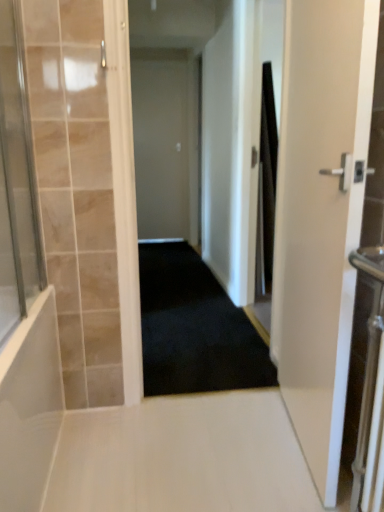
What do you see at coordinates (194, 328) in the screenshot? I see `black carpet at center` at bounding box center [194, 328].

This screenshot has width=384, height=512. Find the location of `black fabric shower curtain at right`. black fabric shower curtain at right is located at coordinates (268, 165).

Is transparent glass shower door at left touching white glossy door at right, the 1th door positioned from the front?

No.

Is transparent glass shower door at left completely or partially outside of white glossy door at right, the 2th door positioned from the left?

Yes, transparent glass shower door at left is not within white glossy door at right, the 2th door positioned from the left.

Is transparent glass shower door at left facing away from white glossy door at right, the 2th door positioned from the left?

transparent glass shower door at left does not have its back to white glossy door at right, the 2th door positioned from the left.

Which is behind, point (142, 503) or point (159, 67)?

The point (159, 67) is more distant.

Can you tell me how much white glossy floor at center and white matte door at center, which ranks as the 1th door in back-to-front order, differ in facing direction?

The angular difference between white glossy floor at center and white matte door at center, which ranks as the 1th door in back-to-front order, is 180 degrees.

Where is `door located behind the white glossy floor at center`? The image size is (384, 512). door located behind the white glossy floor at center is located at coordinates (161, 144).

From a real-world perspective, between transparent glass shower door at left and black fabric shower curtain at right, who is vertically lower?

From a 3D spatial view, black fabric shower curtain at right is below.

Consider the image. Does transparent glass shower door at left turn towards black fabric shower curtain at right?

No, transparent glass shower door at left is not turned towards black fabric shower curtain at right.

Locate an element on the screen. The image size is (384, 512). glass door above the black fabric shower curtain at right (from a real-world perspective) is located at coordinates (17, 180).

In terms of size, does transparent glass shower door at left appear bigger or smaller than black fabric shower curtain at right?

Considering their sizes, transparent glass shower door at left takes up more space than black fabric shower curtain at right.

Is white matte door at center, placed as the 1th door when sorted from left to right, next to transparent glass shower door at left?

No.

Does white matte door at center, which ranks as the 2th door in right-to-left order, contain transparent glass shower door at left?

No, transparent glass shower door at left is located outside of white matte door at center, which ranks as the 2th door in right-to-left order.

Based on the photo, from a real-world perspective, is white matte door at center, which appears as the 2th door when viewed from the front, physically above transparent glass shower door at left?

No, from a real-world perspective, white matte door at center, which appears as the 2th door when viewed from the front, is not above transparent glass shower door at left.

Is white matte door at center, which ranks as the 1th door in back-to-front order, in front of or behind transparent glass shower door at left in the image?

white matte door at center, which ranks as the 1th door in back-to-front order, is positioned farther from the viewer than transparent glass shower door at left.

Is white matte door at center, which appears as the 2th door when viewed from the front, oriented towards white glossy door at right, placed as the first door when sorted from right to left?

Yes, white matte door at center, which appears as the 2th door when viewed from the front, is aimed at white glossy door at right, placed as the first door when sorted from right to left.

Is white matte door at center, placed as the 1th door when sorted from left to right, to the left of white glossy door at right, placed as the first door when sorted from right to left, from the viewer's perspective?

Indeed, white matte door at center, placed as the 1th door when sorted from left to right, is positioned on the left side of white glossy door at right, placed as the first door when sorted from right to left.

Is white matte door at center, placed as the 1th door when sorted from left to right, thinner than white glossy door at right, the 1th door positioned from the front?

Indeed, white matte door at center, placed as the 1th door when sorted from left to right, has a lesser width compared to white glossy door at right, the 1th door positioned from the front.

Based on the photo, can you confirm if white matte door at center, which ranks as the 2th door in right-to-left order, is shorter than white glossy door at right, the 1th door positioned from the front?

Incorrect, the height of white matte door at center, which ranks as the 2th door in right-to-left order, does not fall short of that of white glossy door at right, the 1th door positioned from the front.

Consider the image. From a real-world perspective, is white matte door at center, which appears as the 2th door when viewed from the front, positioned over black fabric shower curtain at right based on gravity?

Yes, from a real-world perspective, white matte door at center, which appears as the 2th door when viewed from the front, is over black fabric shower curtain at right

Between white matte door at center, which ranks as the 1th door in back-to-front order, and black fabric shower curtain at right, which one appears on the left side from the viewer's perspective?

Positioned to the left is white matte door at center, which ranks as the 1th door in back-to-front order.

Is white matte door at center, which ranks as the 1th door in back-to-front order, positioned in front of black fabric shower curtain at right?

No, white matte door at center, which ranks as the 1th door in back-to-front order, is behind black fabric shower curtain at right.

Considering the sizes of objects white matte door at center, which ranks as the 2th door in right-to-left order, and black fabric shower curtain at right in the image provided, who is wider, white matte door at center, which ranks as the 2th door in right-to-left order, or black fabric shower curtain at right?

Wider between the two is black fabric shower curtain at right.

Is white glossy door at right, the 1th door positioned from the front, shorter than black carpet at center?

No, white glossy door at right, the 1th door positioned from the front, is not shorter than black carpet at center.

At what (x,y) coordinates should I click in order to perform the action: click on corridor below the white glossy door at right, placed as the first door when sorted from right to left (from the image's perspective). Please return your answer as a coordinate pair (x, y). Image resolution: width=384 pixels, height=512 pixels. Looking at the image, I should click on (194, 328).

Based on the photo, how many degrees apart are the facing directions of white glossy door at right, the 1th door positioned from the front, and black carpet at center?

They differ by 94.4 degrees in their facing directions.

Does white glossy door at right, the 2th door positioned from the left, turn towards black carpet at center?

No, white glossy door at right, the 2th door positioned from the left, does not turn towards black carpet at center.

The height and width of the screenshot is (512, 384). Identify the location of glass door to the left of white glossy door at right, placed as the first door when sorted from right to left. (17, 180).

The height and width of the screenshot is (512, 384). Identify the location of door behind the white glossy floor at center. (161, 144).

When comparing their distances from white matte door at center, which ranks as the 2th door in right-to-left order, does black fabric shower curtain at right or white glossy floor at center seem further?

white glossy floor at center is further to white matte door at center, which ranks as the 2th door in right-to-left order.

From the image, which object appears to be nearer to white glossy door at right, the 1th door positioned from the front, transparent glass shower door at left or black carpet at center?

black carpet at center is closer to white glossy door at right, the 1th door positioned from the front.

Looking at the image, which one is located further to white glossy floor at center, white glossy door at right, acting as the 2th door starting from the back, or black fabric shower curtain at right?

Among the two, black fabric shower curtain at right is located further to white glossy floor at center.

Which object lies nearer to the anchor point white glossy floor at center, white matte door at center, which ranks as the 1th door in back-to-front order, or black carpet at center?

black carpet at center is closer to white glossy floor at center.

Considering their positions, is transparent glass shower door at left positioned further to black carpet at center than white glossy floor at center?

transparent glass shower door at left lies further to black carpet at center than the other object.

Based on their spatial positions, is black carpet at center or black fabric shower curtain at right closer to white glossy floor at center?

black carpet at center is positioned closer to the anchor white glossy floor at center.

Looking at the image, which one is located further to black carpet at center, white glossy floor at center or black fabric shower curtain at right?

black fabric shower curtain at right is further to black carpet at center.

Looking at the image, which one is located closer to transparent glass shower door at left, white glossy floor at center or white glossy door at right, acting as the 2th door starting from the back?

The object closer to transparent glass shower door at left is white glossy floor at center.

The image size is (384, 512). Identify the location of path between transparent glass shower door at left and black carpet at center along the z-axis. (182, 457).

Locate an element on the screen. The height and width of the screenshot is (512, 384). shower curtain between white glossy door at right, the 1th door positioned from the front, and white matte door at center, which ranks as the 2th door in right-to-left order, along the z-axis is located at coordinates (268, 165).

Locate an element on the screen. The height and width of the screenshot is (512, 384). path between white glossy door at right, acting as the 2th door starting from the back, and black carpet at center from front to back is located at coordinates (182, 457).

Locate an element on the screen. This screenshot has height=512, width=384. door between transparent glass shower door at left and black carpet at center in the front-back direction is located at coordinates (320, 217).